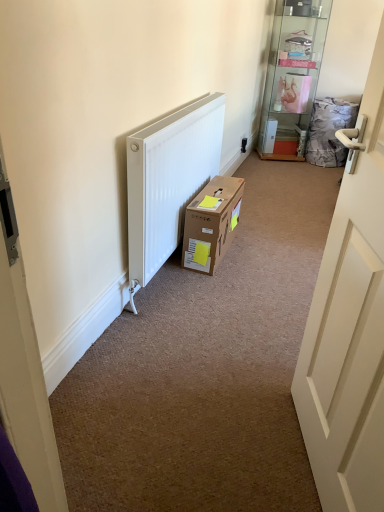
Question: From the image's perspective, is black plastic electric outlet at upper right over clear glass shelf at upper right?

Choices:
 (A) yes
 (B) no

Answer: (B)

Question: Considering the relative sizes of black plastic electric outlet at upper right and clear glass shelf at upper right in the image provided, is black plastic electric outlet at upper right bigger than clear glass shelf at upper right?

Choices:
 (A) yes
 (B) no

Answer: (B)

Question: Is black plastic electric outlet at upper right positioned behind clear glass shelf at upper right?

Choices:
 (A) no
 (B) yes

Answer: (B)

Question: Would you consider black plastic electric outlet at upper right to be distant from clear glass shelf at upper right?

Choices:
 (A) no
 (B) yes

Answer: (A)

Question: Are black plastic electric outlet at upper right and clear glass shelf at upper right making contact?

Choices:
 (A) yes
 (B) no

Answer: (B)

Question: Which is correct: black plastic electric outlet at upper right is inside white matte door at right, or outside of it?

Choices:
 (A) inside
 (B) outside

Answer: (B)

Question: From the image's perspective, is black plastic electric outlet at upper right positioned above or below white matte door at right?

Choices:
 (A) above
 (B) below

Answer: (A)

Question: Is black plastic electric outlet at upper right bigger or smaller than white matte door at right?

Choices:
 (A) small
 (B) big

Answer: (A)

Question: Is point (241, 144) closer or farther from the camera than point (354, 293)?

Choices:
 (A) farther
 (B) closer

Answer: (A)

Question: Considering the positions of white matte door at right and black plastic electric outlet at upper right in the image, is white matte door at right taller or shorter than black plastic electric outlet at upper right?

Choices:
 (A) tall
 (B) short

Answer: (A)

Question: Relative to black plastic electric outlet at upper right, is white matte door at right in front or behind?

Choices:
 (A) behind
 (B) front

Answer: (B)

Question: From the image's perspective, is white matte door at right positioned above or below black plastic electric outlet at upper right?

Choices:
 (A) below
 (B) above

Answer: (A)

Question: From a real-world perspective, is white matte door at right above or below black plastic electric outlet at upper right?

Choices:
 (A) above
 (B) below

Answer: (A)

Question: Does point (339, 506) appear closer or farther from the camera than point (233, 186)?

Choices:
 (A) closer
 (B) farther

Answer: (A)

Question: Considering the positions of white matte door at right and brown cardboard box at center in the image, is white matte door at right taller or shorter than brown cardboard box at center?

Choices:
 (A) short
 (B) tall

Answer: (B)